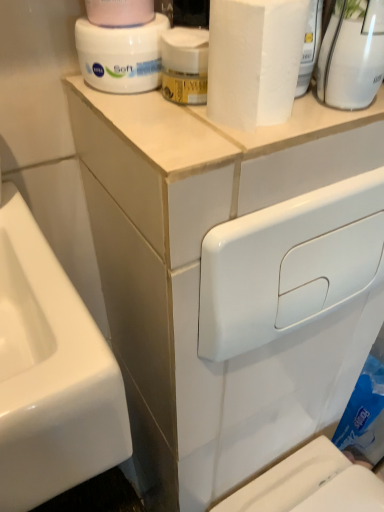
At what (x,y) coordinates should I click in order to perform the action: click on free spot to the left of white matte paper towel at upper center. Please return your answer as a coordinate pair (x, y). Looking at the image, I should click on (156, 125).